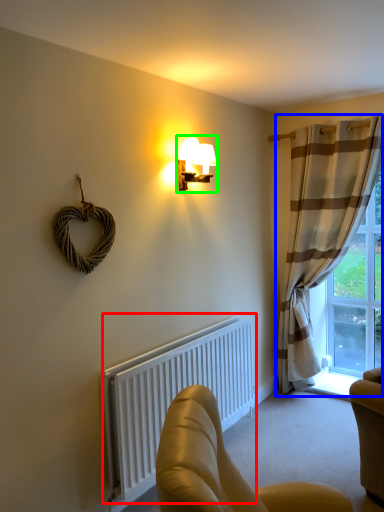
Question: Which object is positioned closest to radiator (highlighted by a red box)? Select from curtain (highlighted by a blue box) and lamp (highlighted by a green box).

Choices:
 (A) curtain
 (B) lamp

Answer: (A)